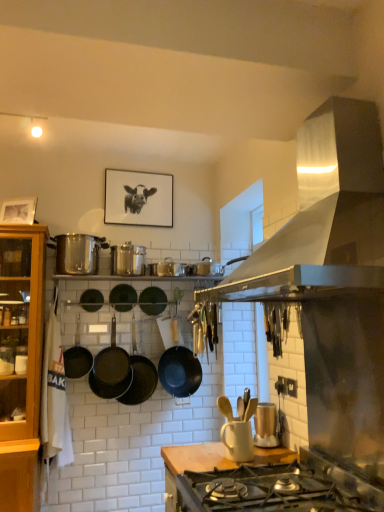
Question: Is green matte wok at center, the fourth wok in the left-to-right sequence, smaller than matte gold toaster at center, which is the first appliance in right-to-left order?

Choices:
 (A) no
 (B) yes

Answer: (B)

Question: Is the position of green matte wok at center, the fourth wok in the left-to-right sequence, more distant than that of matte gold toaster at center, arranged as the second appliance when viewed from the left?

Choices:
 (A) yes
 (B) no

Answer: (A)

Question: Can you confirm if green matte wok at center, the fourth wok in the left-to-right sequence, is wider than matte gold toaster at center, marked as the 2th appliance in a back-to-front arrangement?

Choices:
 (A) yes
 (B) no

Answer: (B)

Question: Would you say matte gold toaster at center, the second appliance viewed from the top, is part of green matte wok at center, the fourth wok in the left-to-right sequence,'s contents?

Choices:
 (A) no
 (B) yes

Answer: (A)

Question: From a real-world perspective, is green matte wok at center, the fourth wok in the left-to-right sequence, located beneath matte gold toaster at center, the 1th appliance in the front-to-back sequence?

Choices:
 (A) yes
 (B) no

Answer: (B)

Question: Is shiny silver pot at left inside the boundaries of black matte wok at center, which is the 1th wok in right-to-left order, or outside?

Choices:
 (A) inside
 (B) outside

Answer: (B)

Question: Is shiny silver pot at left taller or shorter than black matte wok at center, the seventh wok when ordered from left to right?

Choices:
 (A) tall
 (B) short

Answer: (B)

Question: Considering their positions, is shiny silver pot at left located in front of or behind black matte wok at center, the seventh wok when ordered from left to right?

Choices:
 (A) behind
 (B) front

Answer: (B)

Question: Would you say shiny silver pot at left is to the left or to the right of black matte wok at center, the seventh wok when ordered from left to right, in the picture?

Choices:
 (A) left
 (B) right

Answer: (A)

Question: Considering the positions of point (61, 261) and point (122, 269), is point (61, 261) closer or farther from the camera than point (122, 269)?

Choices:
 (A) farther
 (B) closer

Answer: (A)

Question: From the image's perspective, is shiny silver pot at left positioned above or below shiny metallic canisters at center, positioned as the 2th appliance in front-to-back order?

Choices:
 (A) below
 (B) above

Answer: (B)

Question: Considering their positions, is shiny silver pot at left located in front of or behind shiny metallic canisters at center, acting as the 1th appliance starting from the top?

Choices:
 (A) front
 (B) behind

Answer: (A)

Question: From their relative heights in the image, would you say shiny silver pot at left is taller or shorter than shiny metallic canisters at center, the first appliance viewed from the back?

Choices:
 (A) short
 (B) tall

Answer: (B)

Question: From the image's perspective, is satin silver range hood at upper right above or below black matte wok at center, the seventh wok when ordered from left to right?

Choices:
 (A) above
 (B) below

Answer: (A)

Question: Is satin silver range hood at upper right spatially inside black matte wok at center, the seventh wok when ordered from left to right, or outside of it?

Choices:
 (A) outside
 (B) inside

Answer: (A)